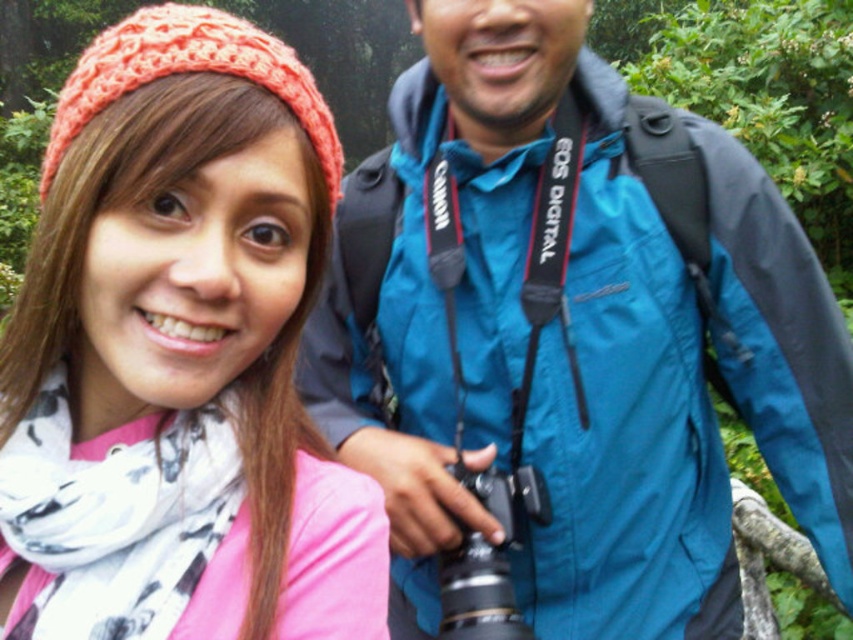
The width and height of the screenshot is (853, 640). What do you see at coordinates (178, 356) in the screenshot?
I see `pink fabric scarf at center` at bounding box center [178, 356].

The width and height of the screenshot is (853, 640). I want to click on pink fabric scarf at center, so click(x=178, y=356).

Identify the location of pink fabric scarf at center. (178, 356).